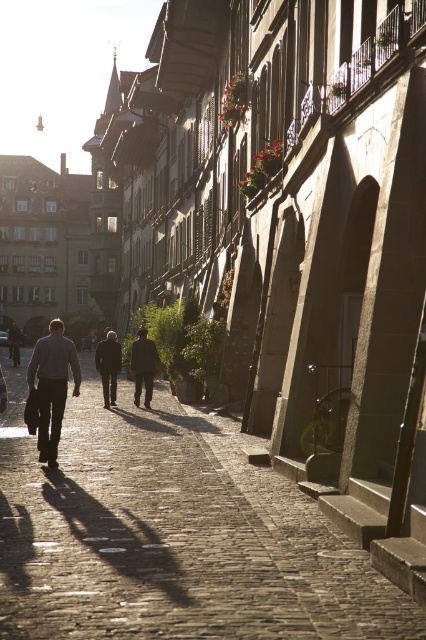
Question: Which is farther from the cobblestone pavement at center?

Choices:
 (A) gray woolen sweater at center
 (B) dark brown suit at center

Answer: (B)

Question: Can you confirm if gray woolen sweater at center is positioned to the left of dark brown leather jacket at center?

Choices:
 (A) no
 (B) yes

Answer: (B)

Question: Considering the relative positions of gray woolen sweater at center and dark brown suit at center in the image provided, where is gray woolen sweater at center located with respect to dark brown suit at center?

Choices:
 (A) left
 (B) right

Answer: (A)

Question: Among these points, which one is farthest from the camera?

Choices:
 (A) (400, 627)
 (B) (106, 360)
 (C) (55, 349)
 (D) (141, 340)

Answer: (D)

Question: In this image, where is cobblestone pavement at center located relative to gray woolen sweater at center?

Choices:
 (A) right
 (B) left

Answer: (A)

Question: Which object is farther from the camera taking this photo?

Choices:
 (A) dark brown leather jacket at center
 (B) cobblestone pavement at center
 (C) dark brown suit at center

Answer: (C)